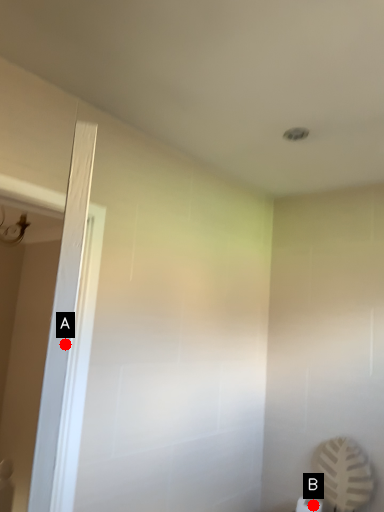
Question: Two points are circled on the image, labeled by A and B beside each circle. Which point is further to the camera?

Choices:
 (A) A is further
 (B) B is further

Answer: (B)